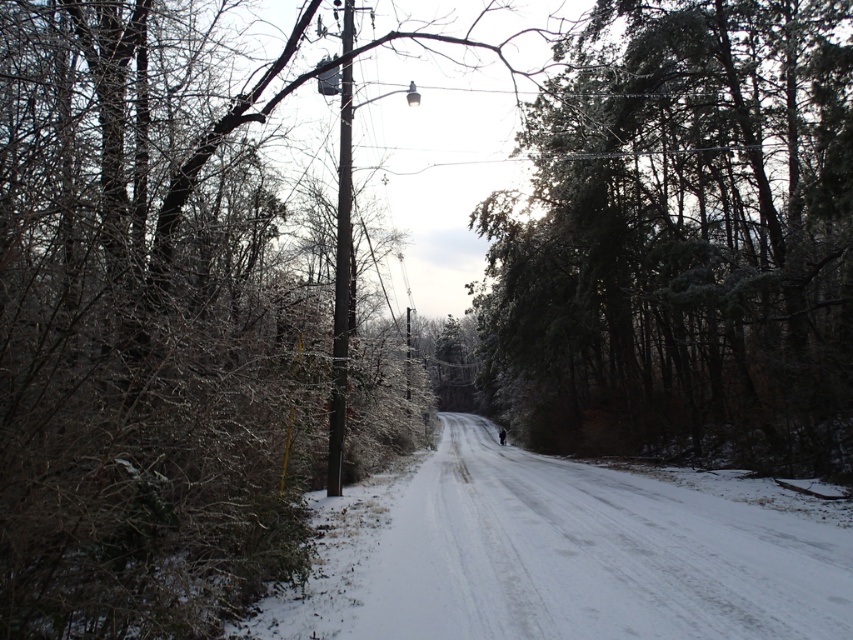
Question: Does green textured tree at center have a smaller size compared to brown wooden pole at center?

Choices:
 (A) yes
 (B) no

Answer: (B)

Question: Considering the relative positions of green textured tree at center and brown wooden pole at center in the image provided, where is green textured tree at center located with respect to brown wooden pole at center?

Choices:
 (A) above
 (B) below

Answer: (B)

Question: Among these objects, which one is farthest from the camera?

Choices:
 (A) green textured tree at center
 (B) brown wooden pole at center

Answer: (A)

Question: Which of the following is the closest to the observer?

Choices:
 (A) brown wooden pole at center
 (B) green textured tree at center

Answer: (A)

Question: Is green textured tree at center above brown wooden pole at center?

Choices:
 (A) no
 (B) yes

Answer: (A)